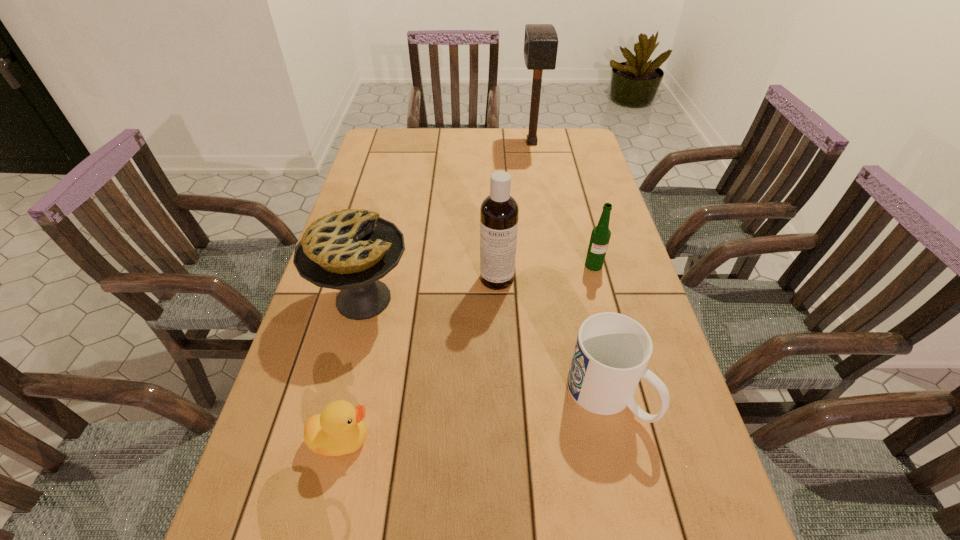
At what (x,y) coordinates should I click in order to perform the action: click on the tallest object. Please return your answer as a coordinate pair (x, y). Looking at the image, I should click on 541,40.

The image size is (960, 540). I want to click on the farthest object, so point(541,40).

This screenshot has height=540, width=960. What are the coordinates of `the fourth object from right to left` in the screenshot? It's located at (499, 212).

What are the coordinates of `dishwasher detergent` in the screenshot? It's located at (x=499, y=212).

You are a GUI agent. You are given a task and a screenshot of the screen. Output one action in this format:
    pyautogui.click(x=<x>, y=<y>)
    Task: Click on the pie
    
    Given the screenshot: What is the action you would take?
    pyautogui.click(x=349, y=250)

Find the location of a particular element. The image size is (960, 540). beer bottle is located at coordinates (600, 236).

The height and width of the screenshot is (540, 960). Find the location of `the fifth tallest object`. the fifth tallest object is located at coordinates (612, 350).

Locate an element on the screen. The width and height of the screenshot is (960, 540). duck is located at coordinates (340, 429).

This screenshot has width=960, height=540. I want to click on free spot located 0.120m on the left of the farthest object, so click(488, 143).

What are the coordinates of `vacant region located on the label side of the third object from left to right` in the screenshot? It's located at (498, 312).